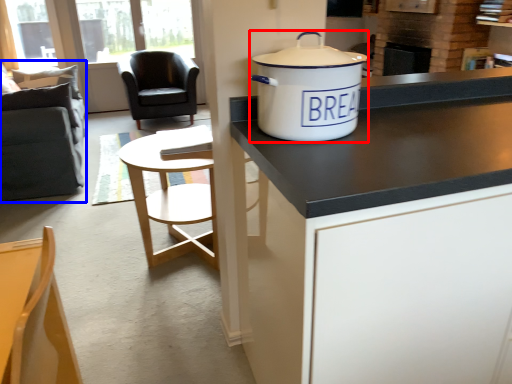
Question: Which object is closer to the camera taking this photo, cooker (highlighted by a red box) or swivel chair (highlighted by a blue box)?

Choices:
 (A) cooker
 (B) swivel chair

Answer: (A)